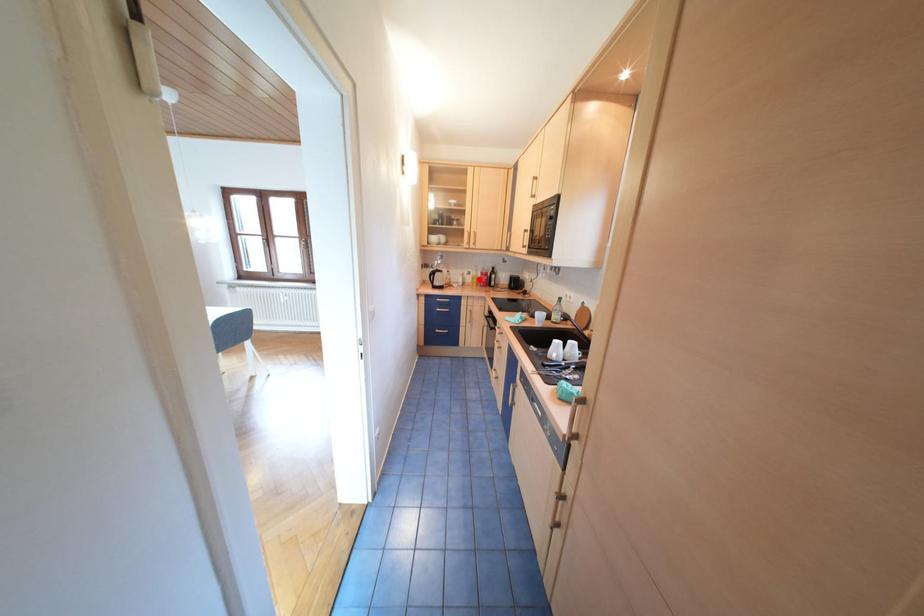
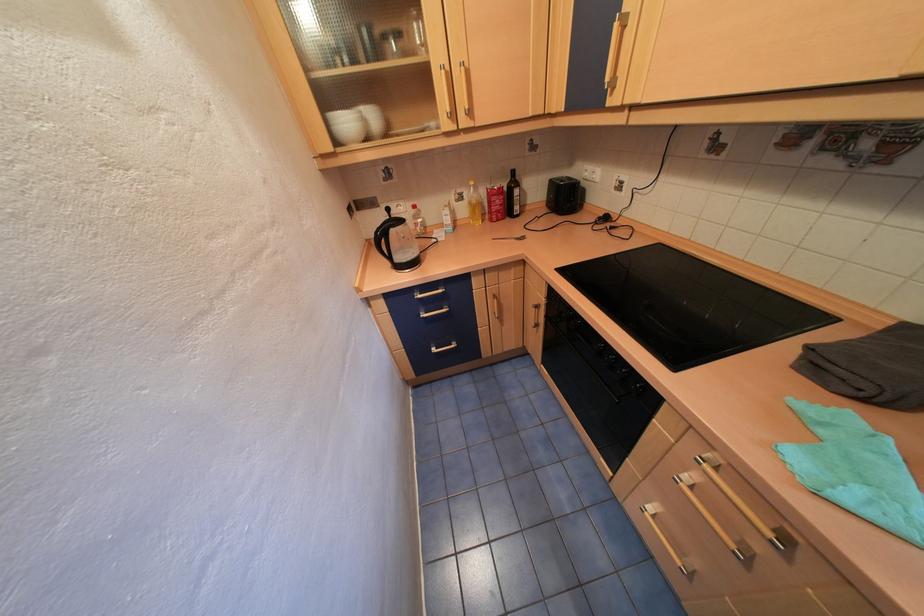
The point at the highlighted location is marked in the first image. Where is the corresponding point in the second image?

(472, 211)